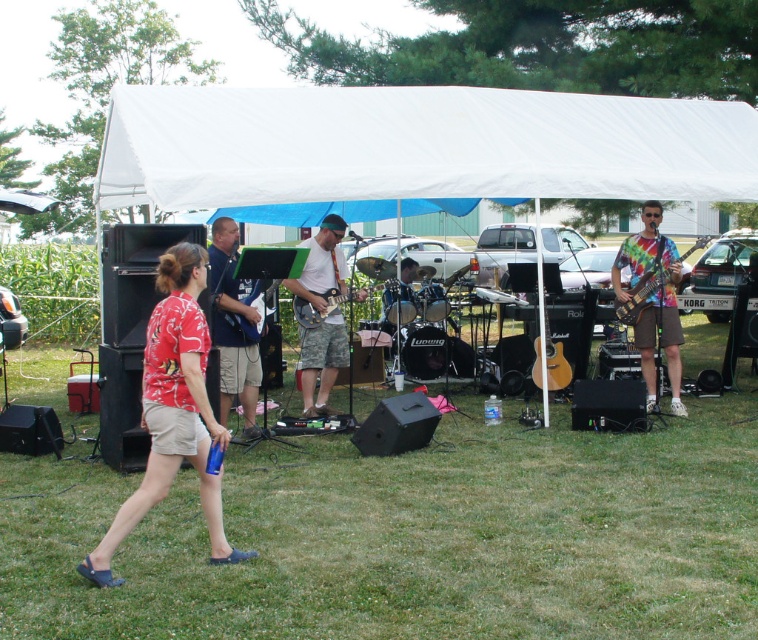
Question: Which point is farther to the camera?

Choices:
 (A) (254, 419)
 (B) (684, 408)

Answer: (B)

Question: Is blue fabric shirt at center wider than metallic silver guitar at center?

Choices:
 (A) yes
 (B) no

Answer: (B)

Question: Which is farther from the red floral shirt at lower left?

Choices:
 (A) blue fabric shirt at center
 (B) white fabric tent at center

Answer: (B)

Question: Can you confirm if green grass at lower center is positioned to the right of blue fabric shirt at center?

Choices:
 (A) yes
 (B) no

Answer: (A)

Question: Does white fabric tent at center appear on the left side of metallic silver guitar at center?

Choices:
 (A) no
 (B) yes

Answer: (A)

Question: Which is farther from the camouflage shorts at center?

Choices:
 (A) tie-dye fabric bass guitar at right
 (B) green grass at lower center

Answer: (B)